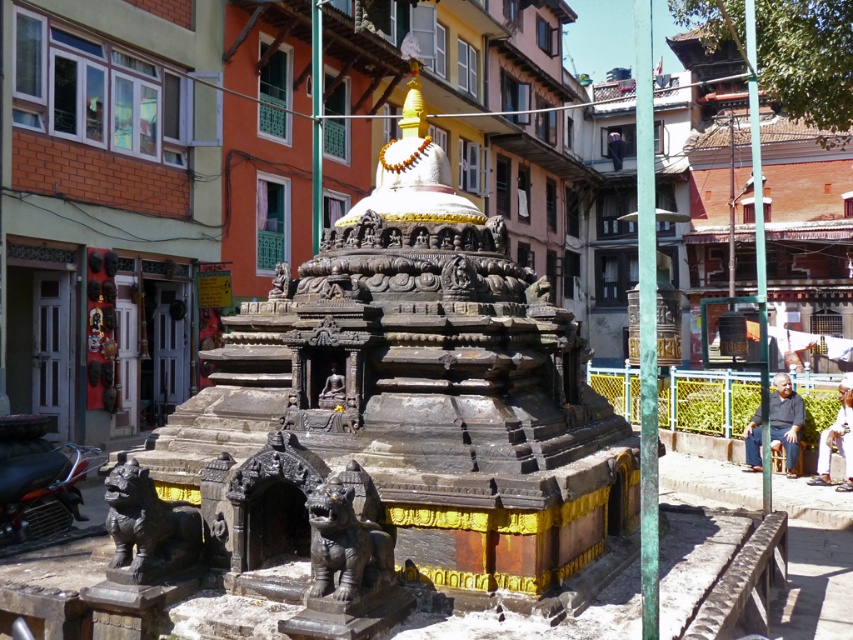
Question: Can you confirm if polished bronze lion at lower left is wider than shiny black motorcycle at lower left?

Choices:
 (A) no
 (B) yes

Answer: (B)

Question: Which object appears closest to the camera in this image?

Choices:
 (A) shiny black motorcycle at lower left
 (B) polished bronze lion at lower left
 (C) matte bronze statue at center
 (D) bronze statue at center

Answer: (B)

Question: Which object is positioned closest to the bronze statue at center?

Choices:
 (A) matte bronze statue at center
 (B) shiny black motorcycle at lower left

Answer: (A)

Question: Does polished bronze lion at lower left have a smaller size compared to shiny black motorcycle at lower left?

Choices:
 (A) yes
 (B) no

Answer: (A)

Question: Does shiny black motorcycle at lower left appear on the right side of matte bronze statue at center?

Choices:
 (A) yes
 (B) no

Answer: (B)

Question: Which object is the closest to the shiny black motorcycle at lower left?

Choices:
 (A) polished bronze lion at lower left
 (B) bronze statue at center
 (C) matte bronze statue at center

Answer: (A)